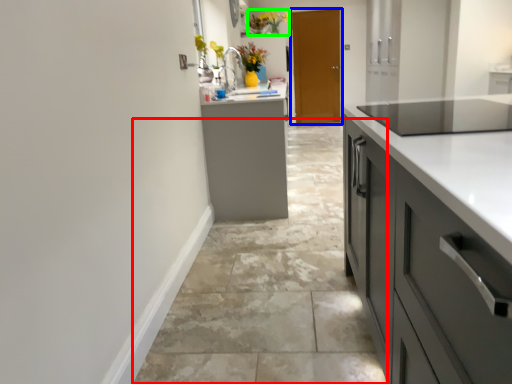
Question: Considering the real-world distances, which object is closest to concrete (highlighted by a red box)? door (highlighted by a blue box) or floral arrangement (highlighted by a green box).

Choices:
 (A) door
 (B) floral arrangement

Answer: (A)